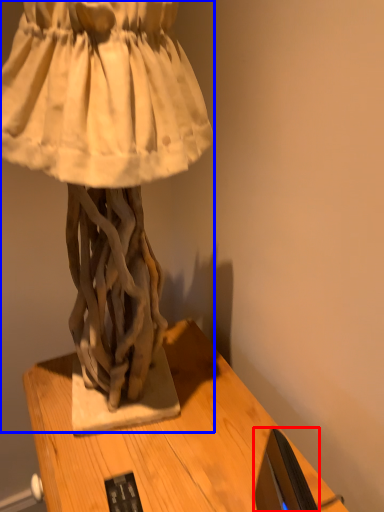
Question: Which object appears closest to the camera in this image, computer monitor (highlighted by a red box) or sculpture (highlighted by a blue box)?

Choices:
 (A) computer monitor
 (B) sculpture

Answer: (B)